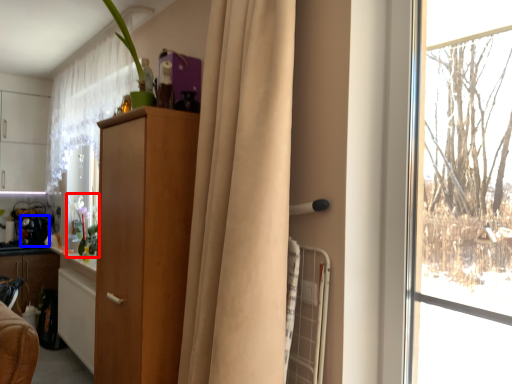
Question: Which of the following is the closest to the observer, floral arrangement (highlighted by a red box) or appliance (highlighted by a blue box)?

Choices:
 (A) floral arrangement
 (B) appliance

Answer: (A)